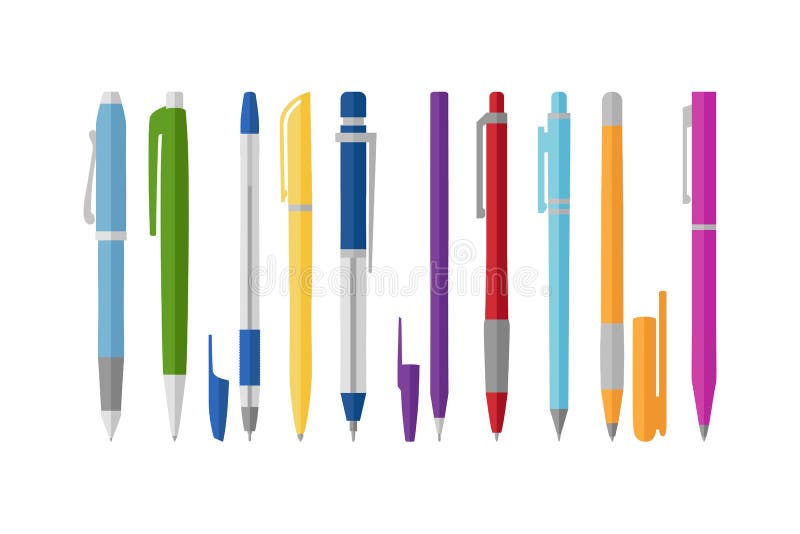
Find the location of a particular element. The width and height of the screenshot is (800, 534). pens is located at coordinates (109, 225), (172, 243), (249, 259), (298, 271), (346, 276), (433, 273), (489, 278), (557, 285), (614, 290), (696, 303).